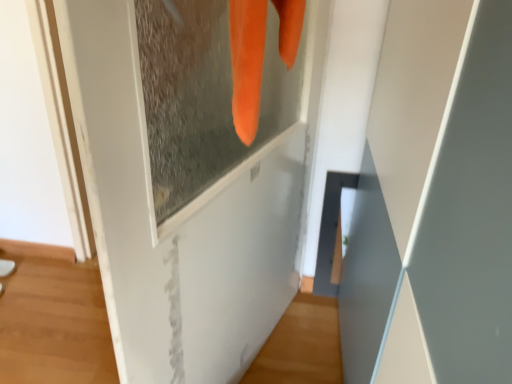
What are the coordinates of `white glossy door at upper center` in the screenshot? It's located at (184, 184).

Describe the element at coordinates (184, 184) in the screenshot. This screenshot has height=384, width=512. I see `white glossy door at upper center` at that location.

This screenshot has width=512, height=384. Find the location of `white glossy door at upper center`. white glossy door at upper center is located at coordinates (184, 184).